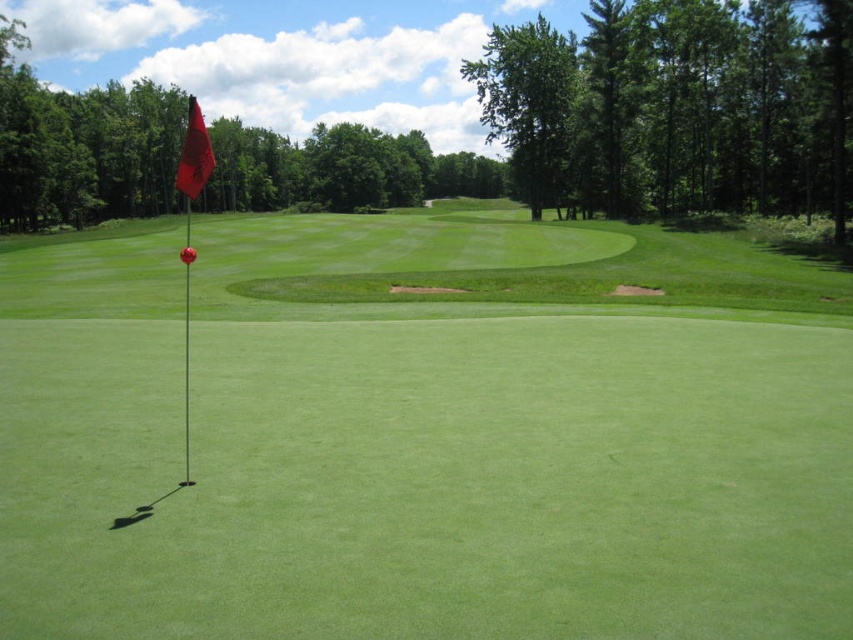
Can you confirm if red flag at center is thinner than red fabric flag at upper left?

No, red flag at center is not thinner than red fabric flag at upper left.

Is red flag at center positioned before red fabric flag at upper left?

That is True.

What are the coordinates of `red flag at center` in the screenshot? It's located at (410, 445).